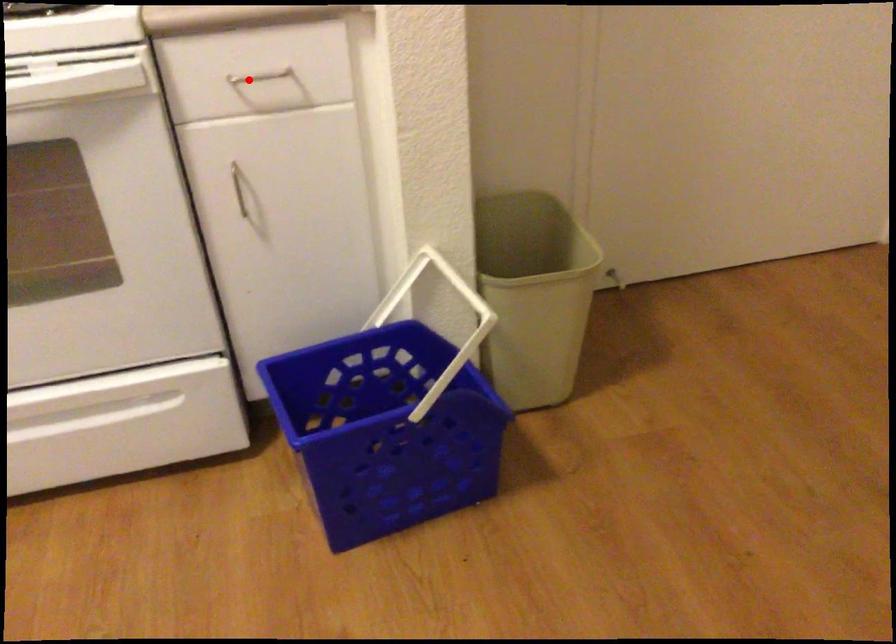
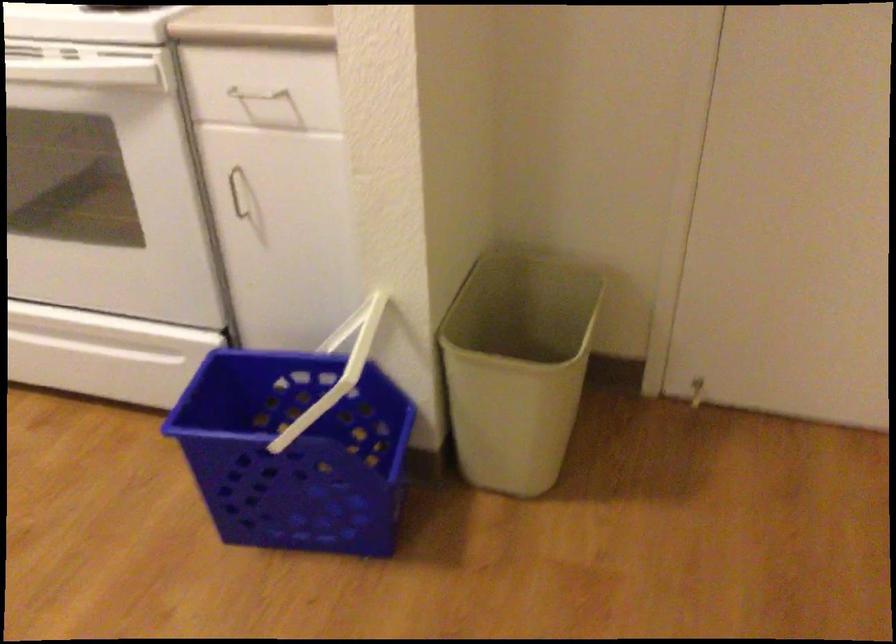
The point at the highlighted location is marked in the first image. Where is the corresponding point in the second image?

(253, 98)